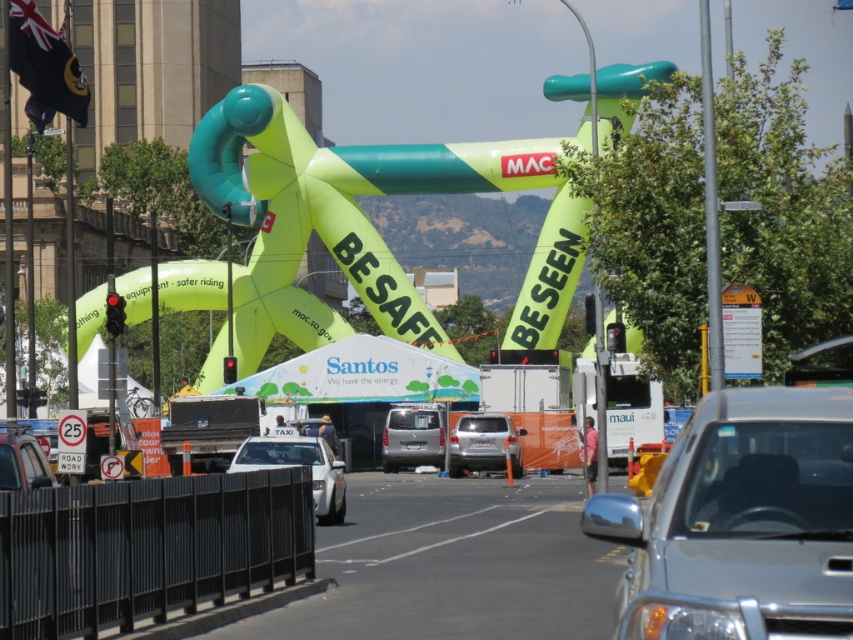
You are a pedestrian standing on the sidewalk and see the white glossy taxi at center and the orange plastic sign at upper right. Which object is taller?

The orange plastic sign at upper right is taller than the white glossy taxi at center.